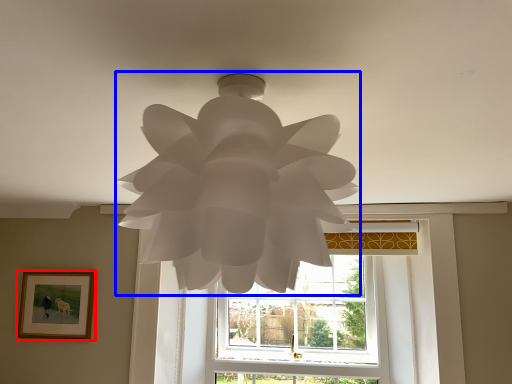
Question: Which object appears closest to the camera in this image, picture frame (highlighted by a red box) or lamp (highlighted by a blue box)?

Choices:
 (A) picture frame
 (B) lamp

Answer: (B)